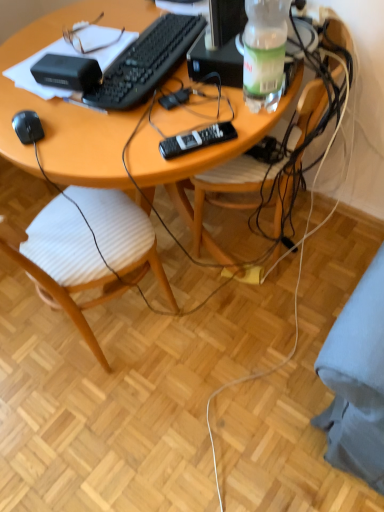
Where is `free space between black matte computer mouse at lower left and black plastic remote at center`? This screenshot has width=384, height=512. free space between black matte computer mouse at lower left and black plastic remote at center is located at coordinates (119, 134).